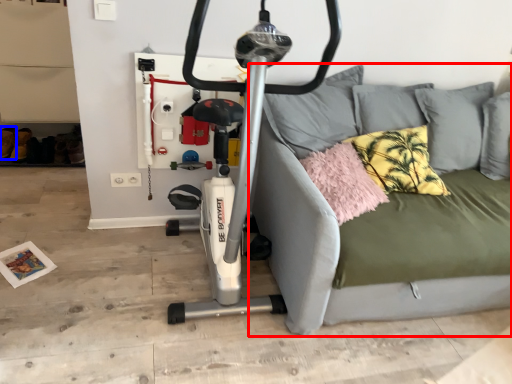
Question: Which point is closer to the camera, studio couch (highlighted by a red box) or shoe (highlighted by a blue box)?

Choices:
 (A) studio couch
 (B) shoe

Answer: (A)